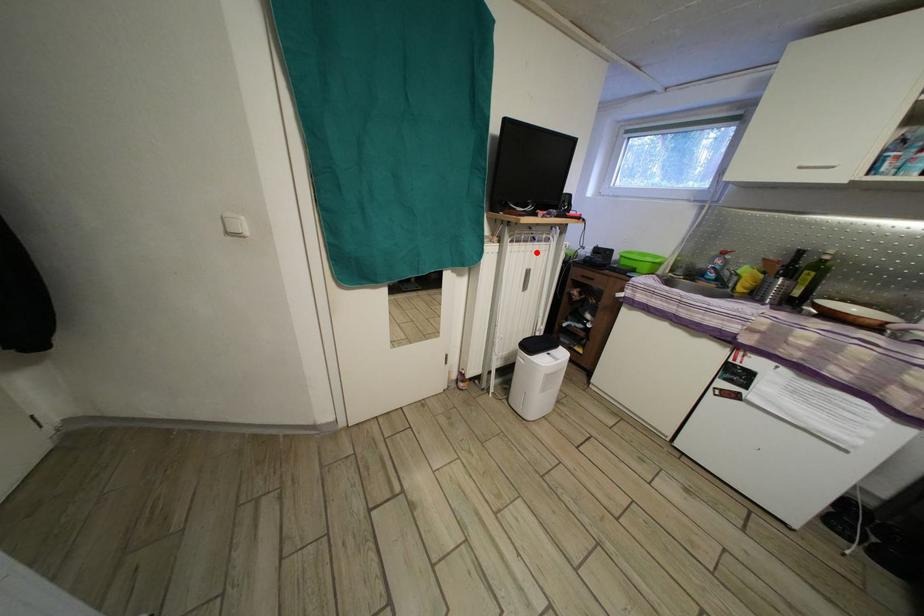
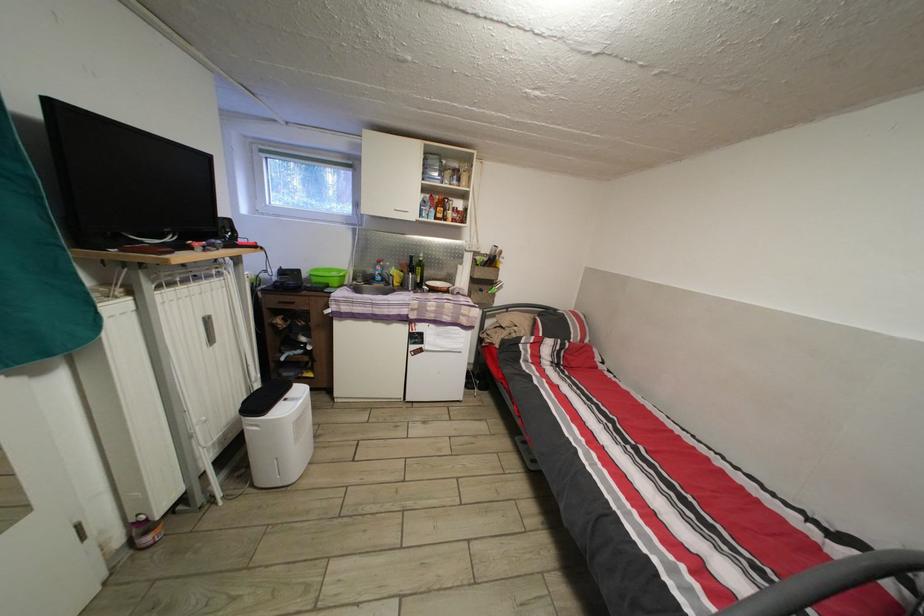
The point at the highlighted location is marked in the first image. Where is the corresponding point in the second image?

(201, 294)